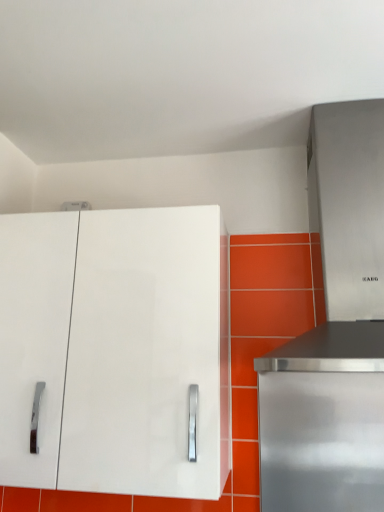
Question: From the image's perspective, is stainless steel range hood at upper right over stainless steel range hood at right?

Choices:
 (A) yes
 (B) no

Answer: (A)

Question: Can you confirm if stainless steel range hood at upper right is thinner than stainless steel range hood at right?

Choices:
 (A) yes
 (B) no

Answer: (B)

Question: Is the position of stainless steel range hood at upper right more distant than that of stainless steel range hood at right?

Choices:
 (A) yes
 (B) no

Answer: (B)

Question: Can you confirm if stainless steel range hood at upper right is wider than stainless steel range hood at right?

Choices:
 (A) no
 (B) yes

Answer: (B)

Question: Is stainless steel range hood at upper right not near stainless steel range hood at right?

Choices:
 (A) yes
 (B) no

Answer: (B)

Question: Is stainless steel range hood at upper right directly adjacent to stainless steel range hood at right?

Choices:
 (A) no
 (B) yes

Answer: (A)

Question: From a real-world perspective, is stainless steel range hood at upper right physically below white glossy cabinet at upper left?

Choices:
 (A) yes
 (B) no

Answer: (B)

Question: Is white glossy cabinet at upper left inside stainless steel range hood at upper right?

Choices:
 (A) no
 (B) yes

Answer: (A)

Question: Does stainless steel range hood at upper right lie behind white glossy cabinet at upper left?

Choices:
 (A) yes
 (B) no

Answer: (B)

Question: Does stainless steel range hood at upper right have a greater height compared to white glossy cabinet at upper left?

Choices:
 (A) no
 (B) yes

Answer: (B)

Question: Is white glossy cabinet at upper left at the back of stainless steel range hood at upper right?

Choices:
 (A) no
 (B) yes

Answer: (A)

Question: From the image's perspective, would you say stainless steel range hood at upper right is shown under white glossy cabinet at upper left?

Choices:
 (A) no
 (B) yes

Answer: (A)

Question: Does stainless steel range hood at right have a greater height compared to stainless steel range hood at upper right?

Choices:
 (A) yes
 (B) no

Answer: (B)